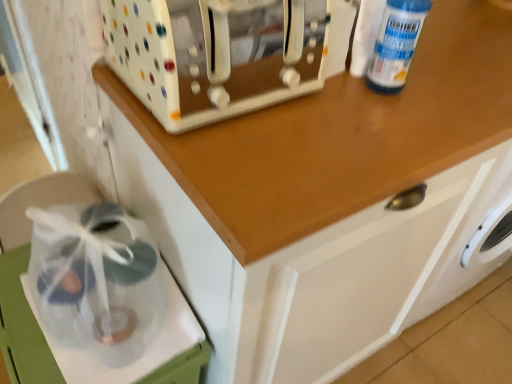
The height and width of the screenshot is (384, 512). I want to click on vacant space situated on the left part of clear plastic bottle at upper right, so click(300, 96).